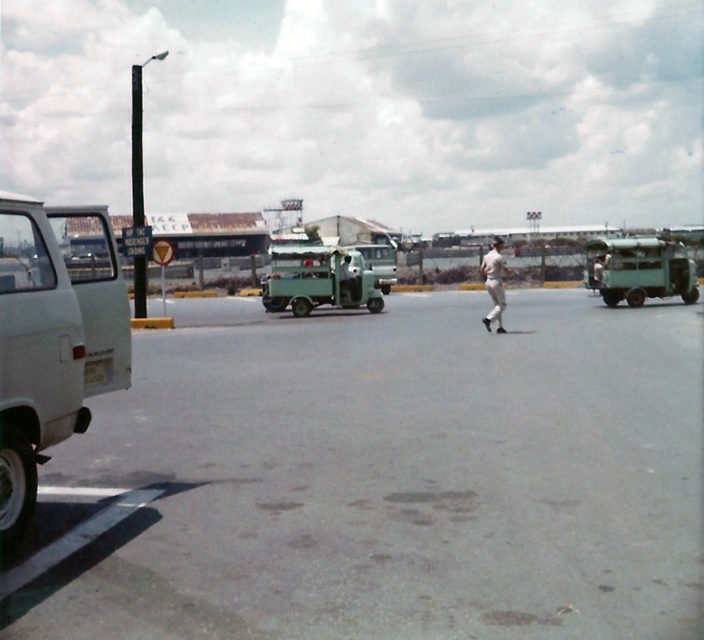
You are a photographer trying to capture both the green matte truck at center and the white fabric baseball cap at center in the same frame. Which object should you zoom in on to ensure both fit in the shot?

The green matte truck at center is thinner than the white fabric baseball cap at center, so you should zoom out to include both objects in the frame.

You are a delivery person who needs to park your 2.5 meter wide truck in the gray asphalt parking lot at center. The white matte van at left is currently occupying part of the parking space. Can your truck fit in the remaining space?

The gray asphalt parking lot at center is wider than the white matte van at left, so there should be enough space for your 2.5 meter wide truck to fit in the remaining area after accounting for the van.